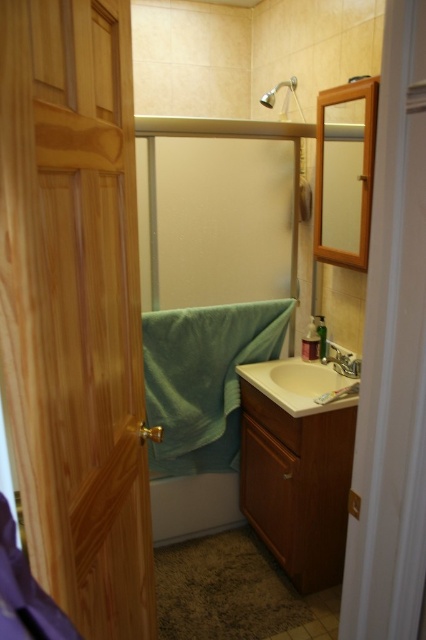
You are standing in the doorway of the bathroom and want to reach the wooden framed mirror at upper right. Which direction should you move relative to the white glossy bathtub at lower center?

The wooden framed mirror at upper right is to the right of the white glossy bathtub at lower center, so you should move to the right side of the white glossy bathtub at lower center to reach it.

You are standing in the hallway outside the bathroom. You want to enter the bathroom but need to know if your 24 inch wide luggage will fit through the doorway. Can you tell me if the wooden door at left is far enough away from you to allow your luggage to pass through?

The wooden door at left is 23.32 inches from viewer. Since your luggage is 24 inches wide, it is slightly wider than the distance available, so the luggage may not fit through the doorway.